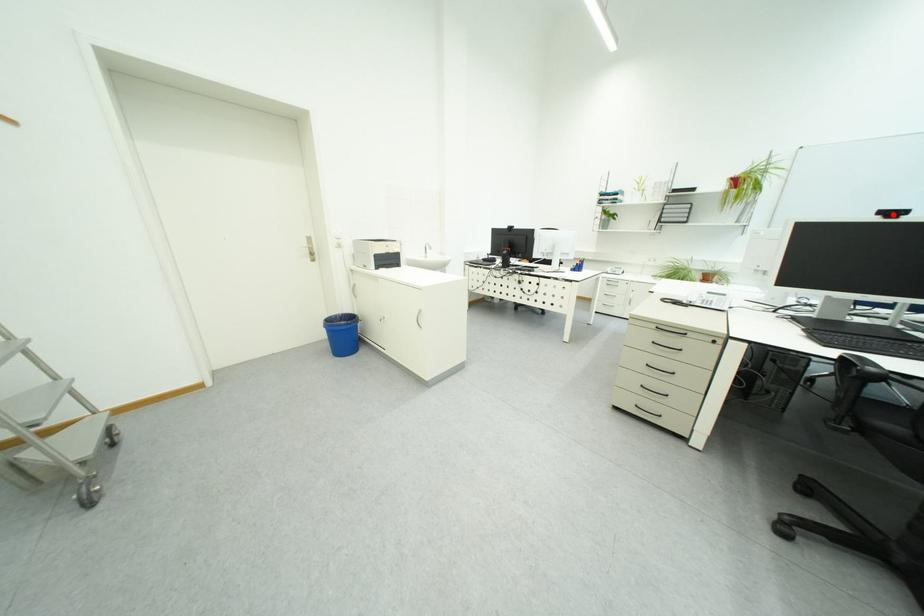
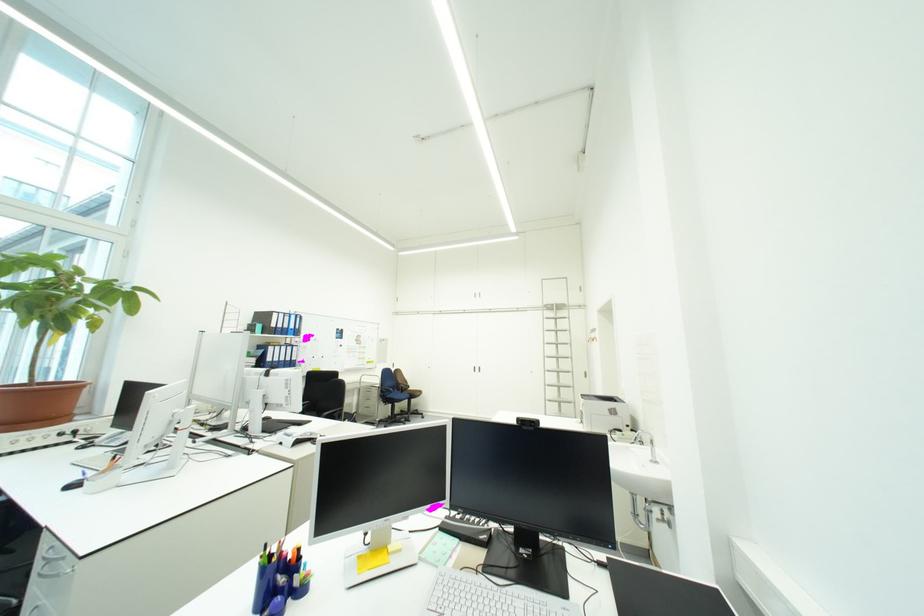
Question: I am providing you with two images of the same scene from different viewpoints. A red point is marked on the first image. At the location where the point appears in image 1, is it still visible in image 2?

Choices:
 (A) Yes
 (B) No

Answer: (B)